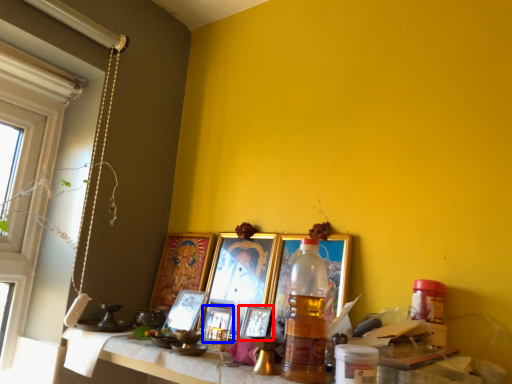
Question: Which point is closer to the camera, picture frame (highlighted by a red box) or picture frame (highlighted by a blue box)?

Choices:
 (A) picture frame
 (B) picture frame

Answer: (A)